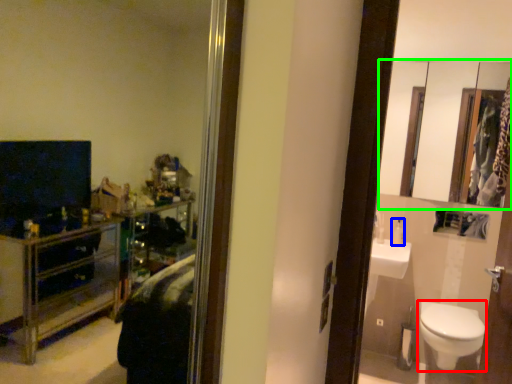
Question: Based on their relative distances, which object is nearer to toilet (highlighted by a red box)? Choose from toiletry (highlighted by a blue box) and mirror (highlighted by a green box).

Choices:
 (A) toiletry
 (B) mirror

Answer: (A)